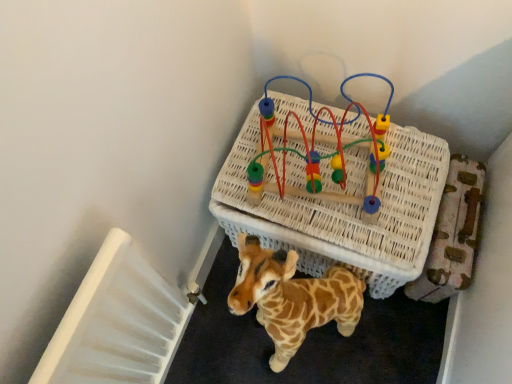
This screenshot has width=512, height=384. What do you see at coordinates (335, 192) in the screenshot? I see `white wicker basket at center` at bounding box center [335, 192].

The image size is (512, 384). Find the location of `white wicker basket at center`. white wicker basket at center is located at coordinates (335, 192).

At what (x,y) coordinates should I click in order to perform the action: click on white wicker basket at center. Please return your answer as a coordinate pair (x, y). Image resolution: width=512 pixels, height=384 pixels. Looking at the image, I should click on (335, 192).